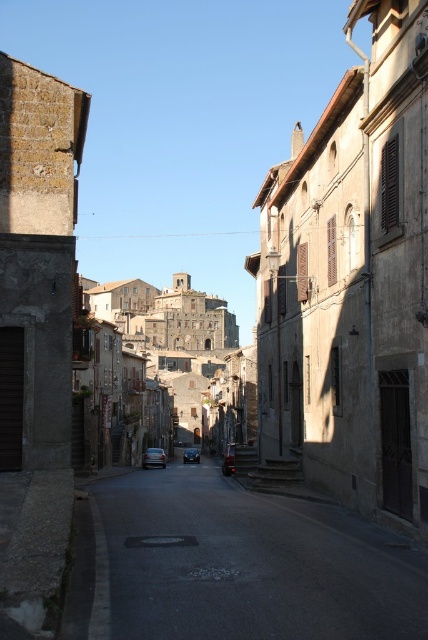
Between point (106, 394) and point (228, 458), which one is positioned behind?

The point (106, 394) is behind.

In the scene shown: Who is shorter, stone castle at center or dark gray metallic car at center?

With less height is dark gray metallic car at center.

Between point (145, 324) and point (234, 444), which one is positioned behind?

Positioned behind is point (145, 324).

The width and height of the screenshot is (428, 640). In order to click on stone castle at center in this screenshot , I will do `click(160, 356)`.

Who is more distant from viewer, (146, 467) or (190, 458)?

Point (190, 458)

Which is in front, point (151, 460) or point (195, 449)?

Point (151, 460)

Identify the location of shiny silver car at center. The image size is (428, 640). (154, 458).

Where is `shiny silver car at center`? This screenshot has width=428, height=640. shiny silver car at center is located at coordinates point(154,458).

In the scene shown: Between shiny silver car at center and dark gray metallic car at center, which one appears on the right side from the viewer's perspective?

Positioned to the right is dark gray metallic car at center.

The width and height of the screenshot is (428, 640). In order to click on shiny silver car at center in this screenshot , I will do `click(154, 458)`.

Locate an element on the screen. shiny silver car at center is located at coordinates [154, 458].